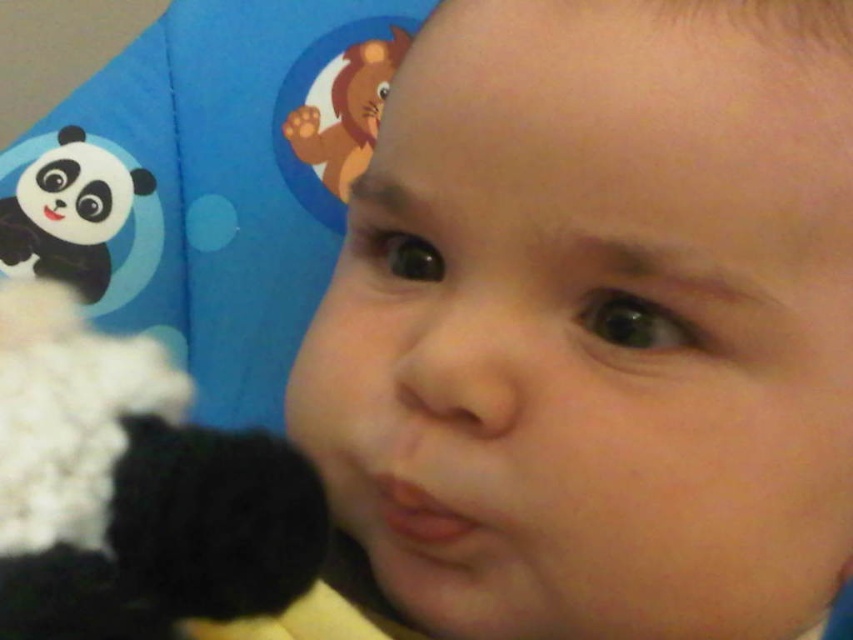
You are a photographer who wants to take a picture of the smooth skin baby at center and the matte plastic lion at upper left. Based on their positions, which object is closer to the bottom edge of the frame?

The smooth skin baby at center is closer to the bottom edge of the frame because it is positioned below the matte plastic lion at upper left.

You are a parent holding a baby and want to hand them the black plush panda at left and the matte plastic lion at upper left. Which toy is closer to the baby?

The black plush panda at left is closer to the baby since it is only 5.72 inches away from the matte plastic lion at upper left.

You are a parent trying to choose a toy for your baby. You see the black plush panda at left and the matte plastic lion at upper left in the image. Which toy is taller?

The black plush panda at left is taller than the matte plastic lion at upper left.